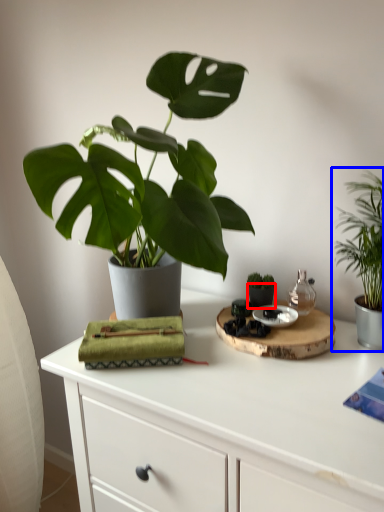
Question: Which object is closer to the camera taking this photo, flowerpot (highlighted by a red box) or houseplant (highlighted by a blue box)?

Choices:
 (A) flowerpot
 (B) houseplant

Answer: (B)